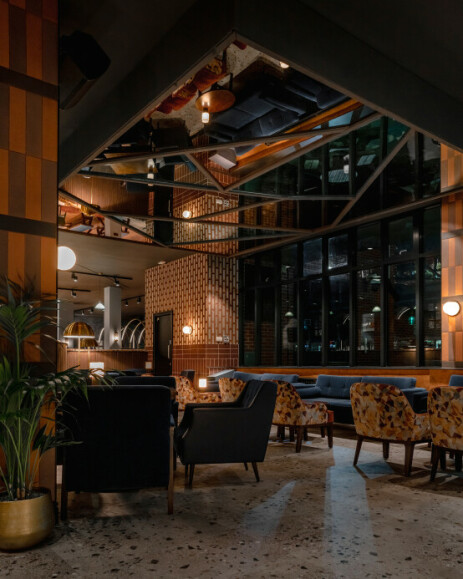
Identify the location of couch back cushions. This screenshot has height=579, width=463. (246, 375), (281, 376), (333, 382), (396, 381), (455, 379).